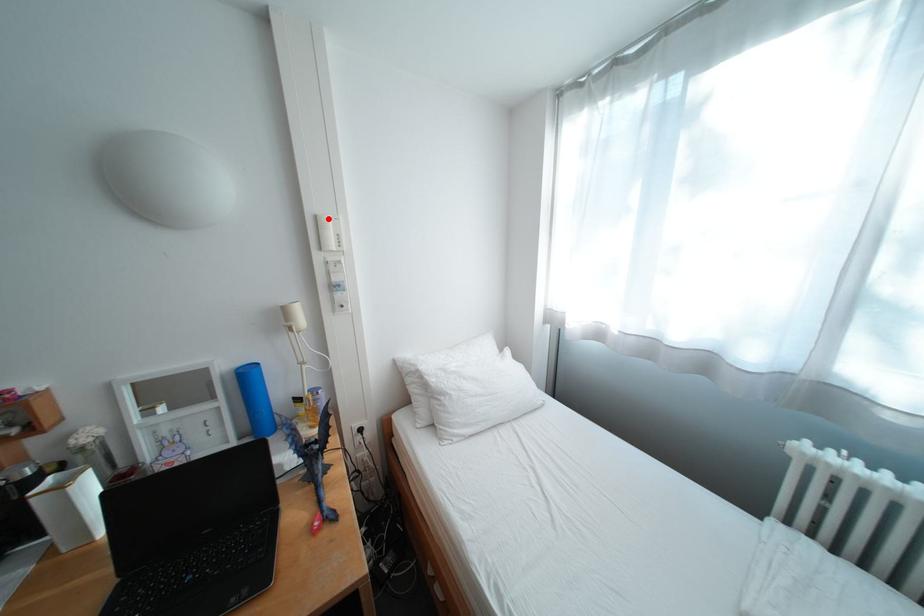
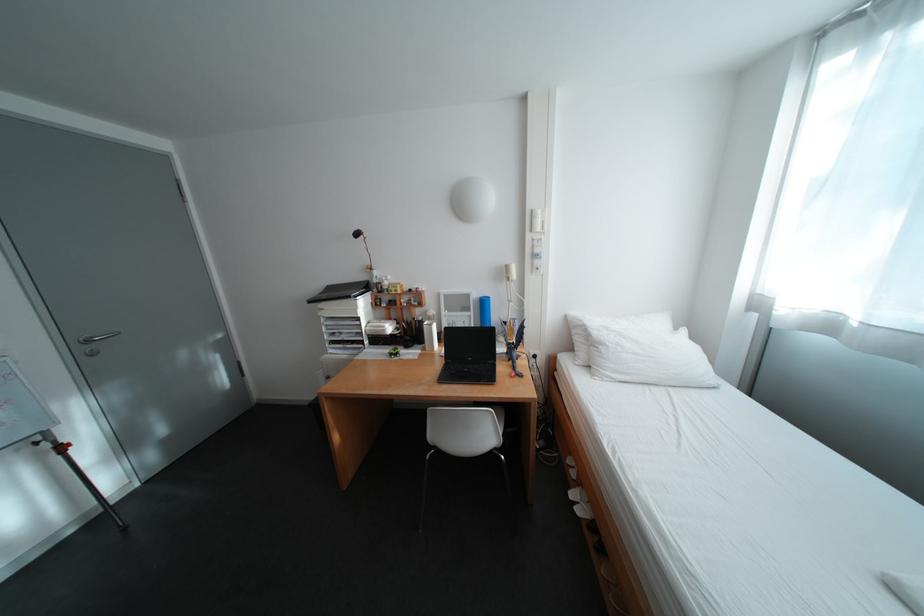
In the second image, find the point that corresponds to the highlighted location in the first image.

(544, 213)